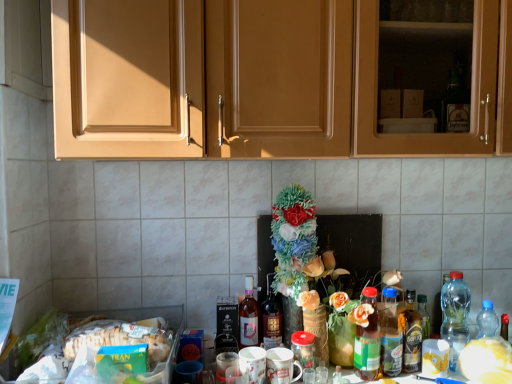
Question: In terms of width, does translucent glass bottle at center right, which appears as the second bottle when viewed from the right, look wider or thinner when compared to translucent glass jar at center?

Choices:
 (A) wide
 (B) thin

Answer: (B)

Question: Is translucent glass bottle at center right, the fifth bottle viewed from the left, in front of or behind translucent glass jar at center in the image?

Choices:
 (A) front
 (B) behind

Answer: (B)

Question: Which object is positioned farthest from the white matte flower at center?

Choices:
 (A) green matte box of tran at lower left
 (B) shiny dark brown bottle at center, which appears as the 2th bottle when viewed from the left
 (C) transparent plastic bottle at right, positioned as the 1th bottle in right-to-left order
 (D) translucent glass bottle at center, which ranks as the first bottle in left-to-right order
 (E) matte wood cabinets at upper center

Answer: (A)

Question: Which is farther from the white matte flower at center?

Choices:
 (A) transparent plastic bottle at right, the sixth bottle positioned from the left
 (B) translucent glass bottle at center, which ranks as the first bottle in left-to-right order
 (C) shiny dark brown bottle at center, which appears as the 2th bottle when viewed from the left
 (D) translucent plastic bottles at center-right, placed as the fourth bottle when sorted from left to right
 (E) green glass bottle at center, the fourth bottle from the right

Answer: (B)